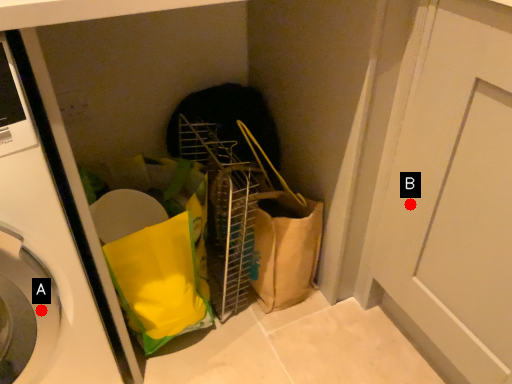
Question: Two points are circled on the image, labeled by A and B beside each circle. Which point appears closest to the camera in this image?

Choices:
 (A) A is closer
 (B) B is closer

Answer: (A)